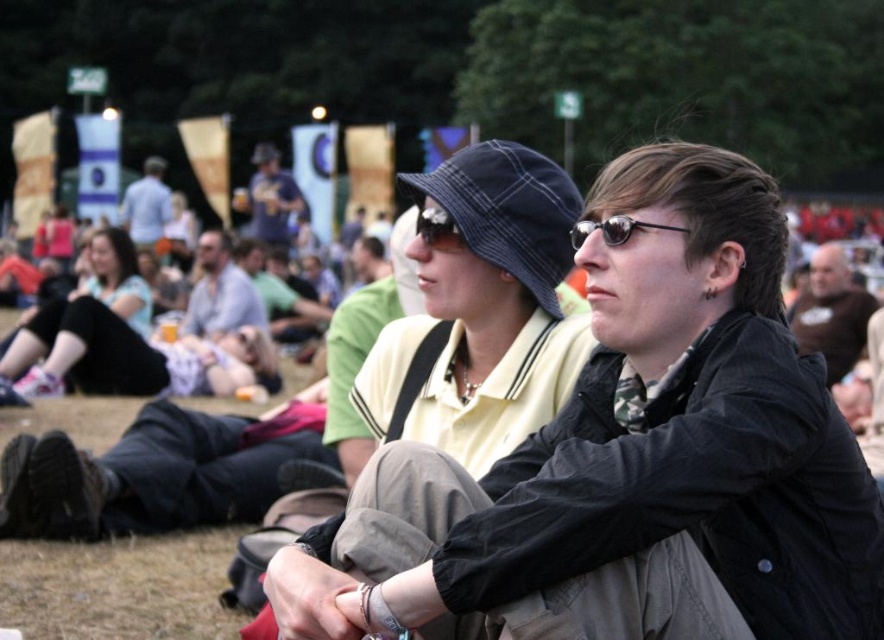
What is located at the coordinates point (x=831, y=312)?

The dark brown leather jacket at upper right is located at point (x=831, y=312).

You are a photographer standing at the edge of a crowded festival. You want to take a photo of both the light gray shirt at center and the light blue shirt at upper center in the same frame. Given that your camera has a maximum zoom range of 20 meters, will you be able to capture both subjects in one shot?

The light gray shirt at center and light blue shirt at upper center are 24.65 meters apart from each other. Since your camera can only zoom up to 20 meters, the distance between them exceeds the maximum zoom range. Therefore, you won the able to capture both subjects in one shot.

You are a photographer trying to capture a clear photo of both the dark brown leather jacket at upper right and the light blue shirt at upper center in the image. Based on their positions, which object should you focus on first to ensure both are in focus?

The dark brown leather jacket at upper right is much taller as light blue shirt at upper center. To ensure both are in focus, you should focus on the dark brown leather jacket at upper right first since it is taller and likely farther away, allowing the depth of field to cover the closer light blue shirt at upper center.